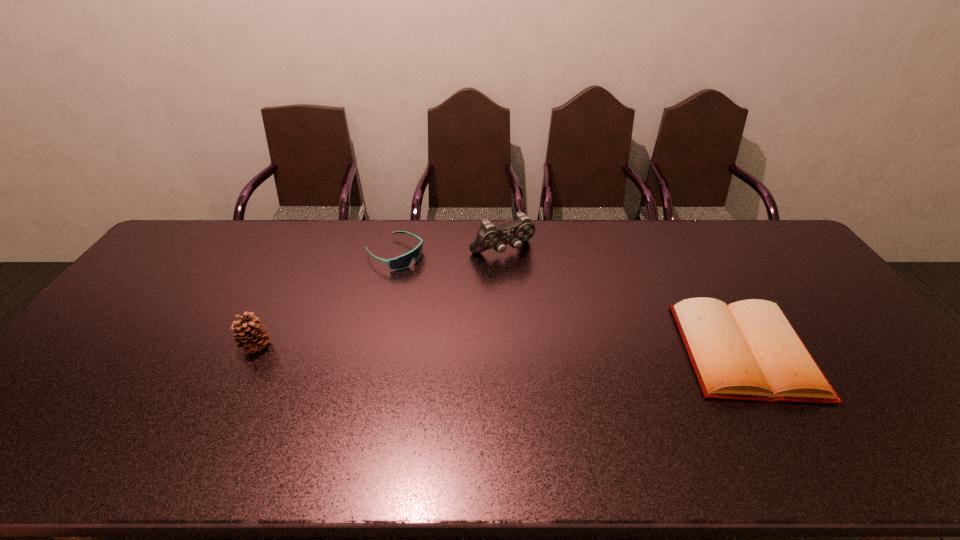
Where is `free space on the desktop that is between the leftmost object and the Bible and is positioned on the surface of the second object from right to left with buttons`? This screenshot has height=540, width=960. free space on the desktop that is between the leftmost object and the Bible and is positioned on the surface of the second object from right to left with buttons is located at coordinates (570, 349).

Where is `free space on the desktop that is between the pinecone and the shortest object and is positioned on the front-facing side of the second object from left to right`? This screenshot has height=540, width=960. free space on the desktop that is between the pinecone and the shortest object and is positioned on the front-facing side of the second object from left to right is located at coordinates (548, 349).